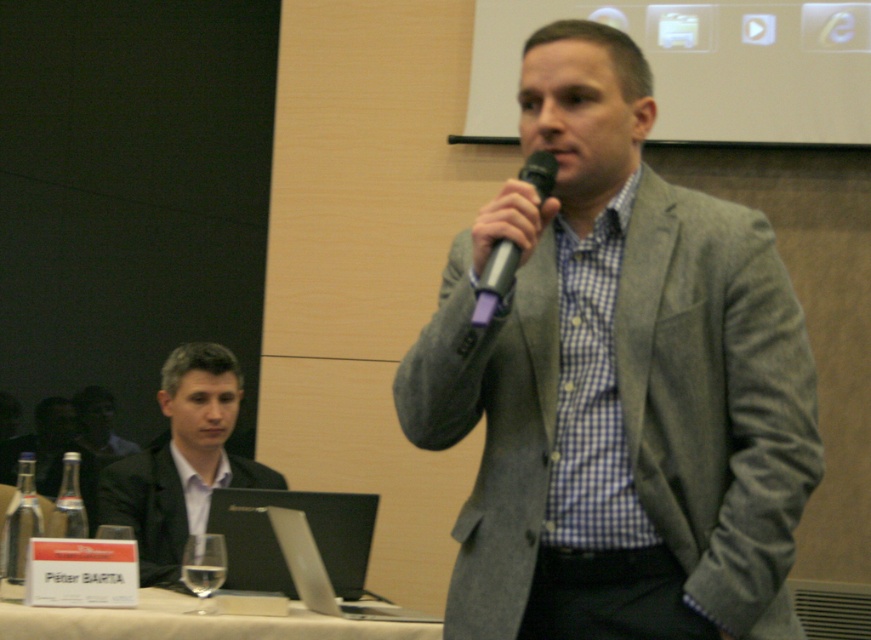
Between white glossy table at lower center and silver metallic microphone at center, which one appears on the right side from the viewer's perspective?

silver metallic microphone at center is more to the right.

Is white glossy table at lower center bigger than silver metallic microphone at center?

Yes.

Measure the distance between white glossy table at lower center and camera.

A distance of 2.45 meters exists between white glossy table at lower center and camera.

Locate an element on the screen. white glossy table at lower center is located at coordinates (192, 621).

Which is in front, point (247, 506) or point (287, 547)?

Point (287, 547) is in front.

Is black matte laptop at lower center to the right of silver metallic laptop at lower center from the viewer's perspective?

No, black matte laptop at lower center is not to the right of silver metallic laptop at lower center.

Between point (363, 538) and point (383, 616), which one is positioned behind?

Point (363, 538)

Where is `black matte laptop at lower center`? The width and height of the screenshot is (871, 640). black matte laptop at lower center is located at coordinates (278, 544).

Measure the distance between gray woolen blazer at center and white glossy table at lower center.

1.08 meters

Which of these two, gray woolen blazer at center or white glossy table at lower center, stands shorter?

white glossy table at lower center is shorter.

Between point (537, 627) and point (19, 634), which one is positioned behind?

The point (19, 634) is behind.

Locate an element on the screen. gray woolen blazer at center is located at coordinates click(x=618, y=385).